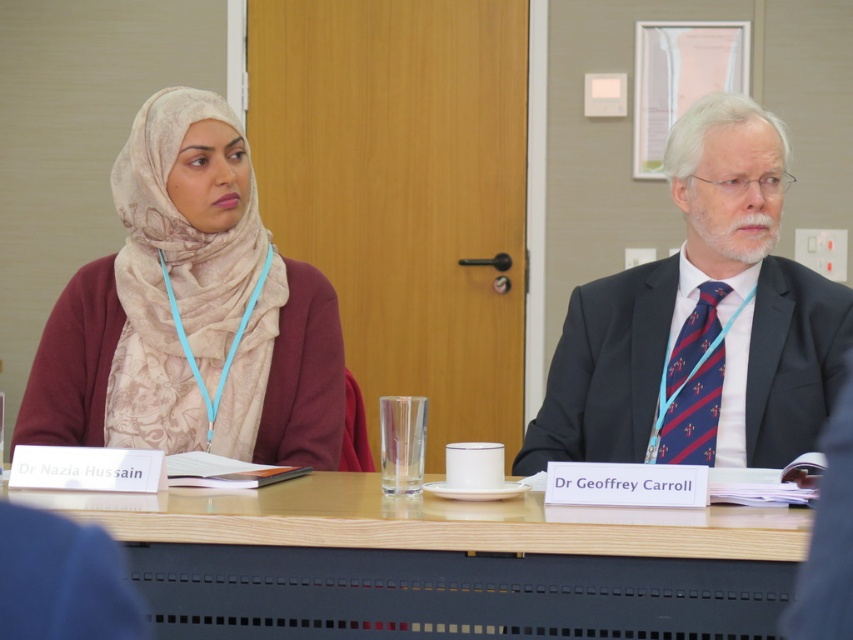
Question: Among these points, which one is nearest to the camera?

Choices:
 (A) (328, 497)
 (B) (769, 193)
 (C) (672, 355)

Answer: (A)

Question: Does wooden table at center appear on the right side of beige floral hijab at center?

Choices:
 (A) no
 (B) yes

Answer: (B)

Question: Does beige floral hijab at center appear under dark blue striped tie at right?

Choices:
 (A) yes
 (B) no

Answer: (B)

Question: Which point is farther to the camera?

Choices:
 (A) [167, 189]
 (B) [683, 417]
 (C) [567, 602]
 (D) [595, 349]

Answer: (A)

Question: Which point is closer to the camera?

Choices:
 (A) (312, 332)
 (B) (682, 364)
 (C) (300, 625)
 (D) (616, 456)

Answer: (C)

Question: Does dark blue suit at right appear on the right side of dark blue striped tie at right?

Choices:
 (A) no
 (B) yes

Answer: (B)